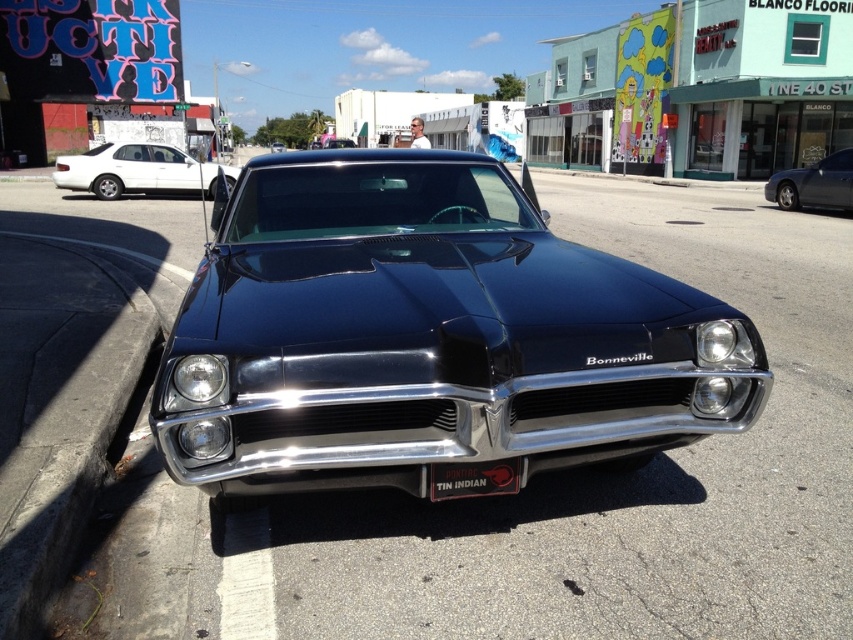
Does shiny black car at center appear on the left side of satin black sedan at right?

Correct, you'll find shiny black car at center to the left of satin black sedan at right.

Is shiny black car at center positioned behind satin black sedan at right?

No, shiny black car at center is in front of satin black sedan at right.

Which is behind, point (256, 355) or point (779, 196)?

The point (779, 196) is behind.

Identify the location of shiny black car at center. This screenshot has width=853, height=640. (427, 333).

Between point (305, 273) and point (115, 161), which one is positioned behind?

The point (115, 161) is more distant.

Is shiny black car at center above white glossy sedan at upper left?

No, shiny black car at center is not above white glossy sedan at upper left.

Does point (434, 412) lie in front of point (129, 161)?

Yes.

Where is `shiny black car at center`? This screenshot has width=853, height=640. shiny black car at center is located at coordinates (427, 333).

Which is more to the left, satin black sedan at right or black matte license plate at center?

Positioned to the left is black matte license plate at center.

Which of these two, satin black sedan at right or black matte license plate at center, stands shorter?

black matte license plate at center is shorter.

What do you see at coordinates (814, 184) in the screenshot? I see `satin black sedan at right` at bounding box center [814, 184].

Identify the location of satin black sedan at right. (814, 184).